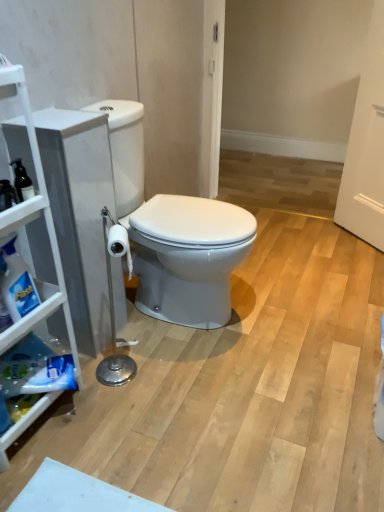
Question: Considering the relative sizes of white glossy toilet at center and white matte cabinet at left in the image provided, is white glossy toilet at center thinner than white matte cabinet at left?

Choices:
 (A) no
 (B) yes

Answer: (A)

Question: Is white glossy toilet at center not inside white matte cabinet at left?

Choices:
 (A) yes
 (B) no

Answer: (A)

Question: Does white glossy toilet at center have a larger size compared to white matte cabinet at left?

Choices:
 (A) no
 (B) yes

Answer: (B)

Question: From a real-world perspective, is white glossy toilet at center located higher than white matte cabinet at left?

Choices:
 (A) no
 (B) yes

Answer: (A)

Question: Does white glossy toilet at center have a greater height compared to white matte cabinet at left?

Choices:
 (A) yes
 (B) no

Answer: (B)

Question: From a real-world perspective, is white glossy toilet at center below white matte cabinet at left?

Choices:
 (A) no
 (B) yes

Answer: (B)

Question: Considering the relative sizes of white glossy toilet at center and translucent plastic spray bottle at left in the image provided, is white glossy toilet at center thinner than translucent plastic spray bottle at left?

Choices:
 (A) yes
 (B) no

Answer: (B)

Question: Is white glossy toilet at center positioned beyond the bounds of translucent plastic spray bottle at left?

Choices:
 (A) yes
 (B) no

Answer: (A)

Question: Is white glossy toilet at center further to camera compared to translucent plastic spray bottle at left?

Choices:
 (A) yes
 (B) no

Answer: (A)

Question: Is white glossy toilet at center surrounding translucent plastic spray bottle at left?

Choices:
 (A) no
 (B) yes

Answer: (A)

Question: Is white glossy toilet at center closer to the viewer compared to translucent plastic spray bottle at left?

Choices:
 (A) yes
 (B) no

Answer: (B)

Question: From the image's perspective, is white glossy toilet at center beneath translucent plastic spray bottle at left?

Choices:
 (A) no
 (B) yes

Answer: (A)

Question: Is white matte cabinet at left placed right next to white glossy toilet at center?

Choices:
 (A) no
 (B) yes

Answer: (A)